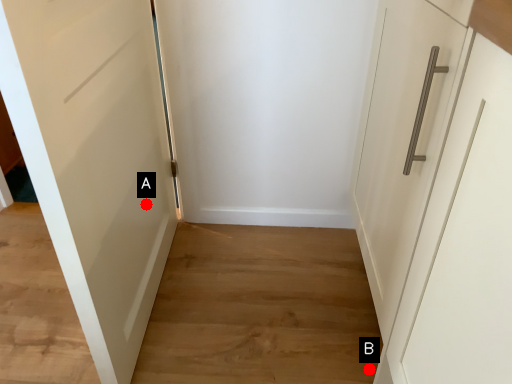
Question: Two points are circled on the image, labeled by A and B beside each circle. Among these points, which one is nearest to the camera?

Choices:
 (A) A is closer
 (B) B is closer

Answer: (B)